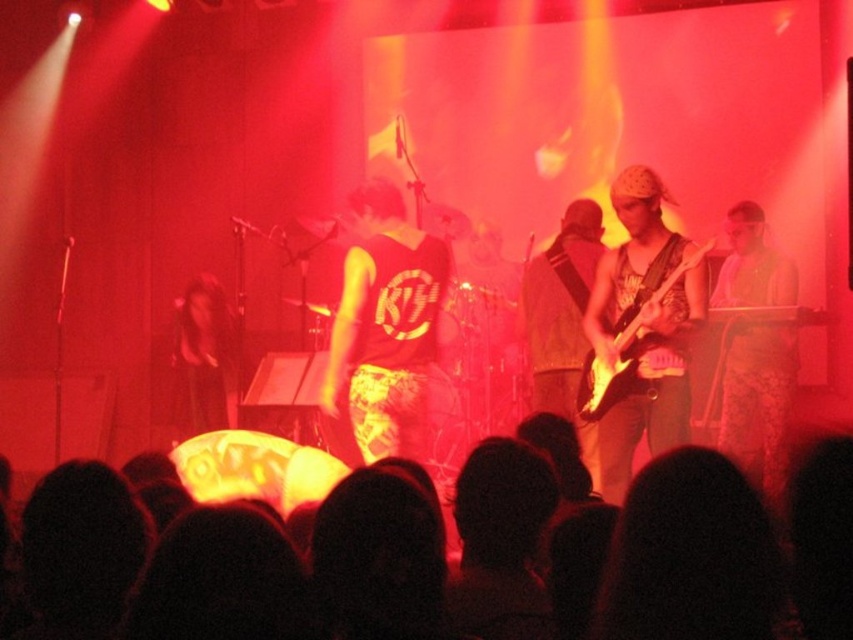
Can you confirm if yellow fabric shirt at center is positioned to the left of shiny black electric guitar at center?

Correct, you'll find yellow fabric shirt at center to the left of shiny black electric guitar at center.

Between point (358, 193) and point (654, 259), which one is positioned behind?

Positioned behind is point (358, 193).

Locate an element on the screen. yellow fabric shirt at center is located at coordinates pos(389,330).

Which of these two, yellow fabric shirt at center or patterned fabric dress at right, stands shorter?

yellow fabric shirt at center is shorter.

Which of these two, yellow fabric shirt at center or patterned fabric dress at right, stands taller?

patterned fabric dress at right is taller.

Locate an element on the screen. yellow fabric shirt at center is located at coordinates (389, 330).

Find the location of `yellow fabric shirt at center`. yellow fabric shirt at center is located at coordinates (389, 330).

Is the position of silhouette crowd at lower center more distant than that of patterned fabric dress at right?

No, silhouette crowd at lower center is closer to the viewer.

Describe the element at coordinates (688, 548) in the screenshot. Image resolution: width=853 pixels, height=640 pixels. I see `silhouette crowd at lower center` at that location.

The image size is (853, 640). I want to click on silhouette crowd at lower center, so click(x=688, y=548).